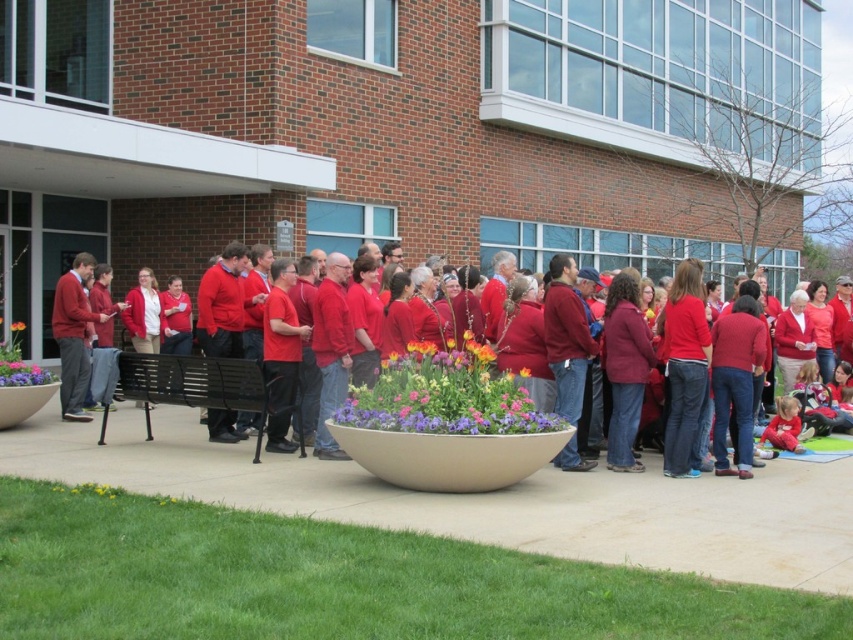
You are standing at the entrance of the brick building and want to place a new decorative item exactly at the center of the walkway. The walkway is represented by the coordinate system where the entrance is at point 0.0 and the end is at point 1.0. The existing vibrant floral bouquet at center is already placed at point (445,396). Can you determine if the bouquet is positioned exactly at the center of the walkway?

The vibrant floral bouquet at center is located at point (445,396), which is not exactly at the center of the walkway since the center would be at point 0.5, 0.5. Therefore, the bouquet is slightly offset from the center towards the right and upper side.

You are a photographer taking a picture of the matte ceramic pot at lower left and the orange matte flower at center. Which object should you focus on first if you want to capture both in sharp focus?

The matte ceramic pot at lower left is below the orange matte flower at center, so you should focus on the matte ceramic pot at lower left first to ensure both are in sharp focus.

In the scene shown: You are a photographer taking a group photo of the people in front of the brick building. You need to ensure that the vibrant floral bouquet at center and the matte red sweater at left are both visible in the frame. Given their sizes, which object might require you to adjust your camera angle to include it fully?

The vibrant floral bouquet at center has a larger width than the matte red sweater at left, so it might require adjusting the camera angle to ensure it fits entirely within the frame.